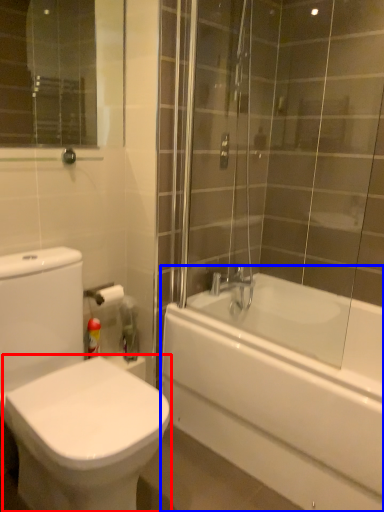
Question: Which point is further to the camera, bidet (highlighted by a red box) or bathtub (highlighted by a blue box)?

Choices:
 (A) bidet
 (B) bathtub

Answer: (B)